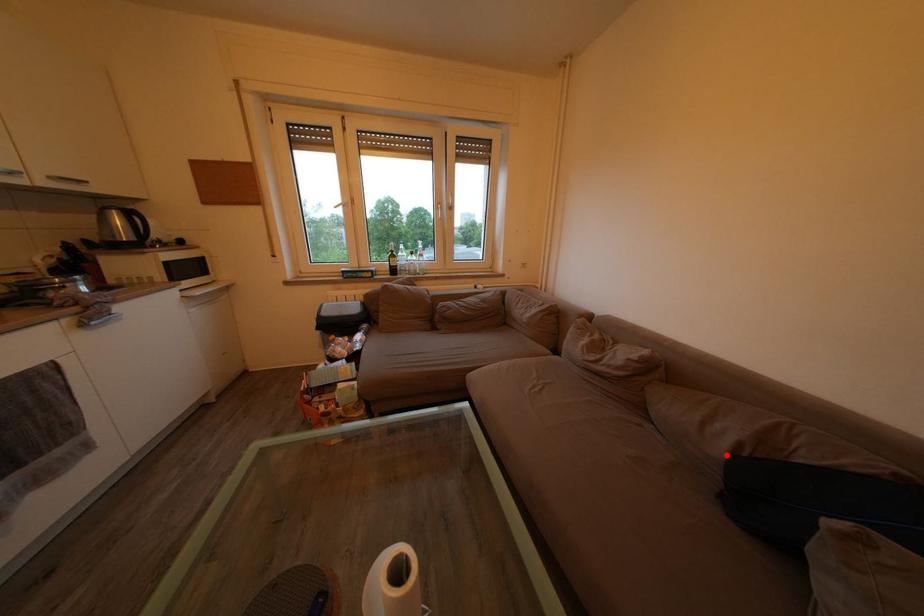
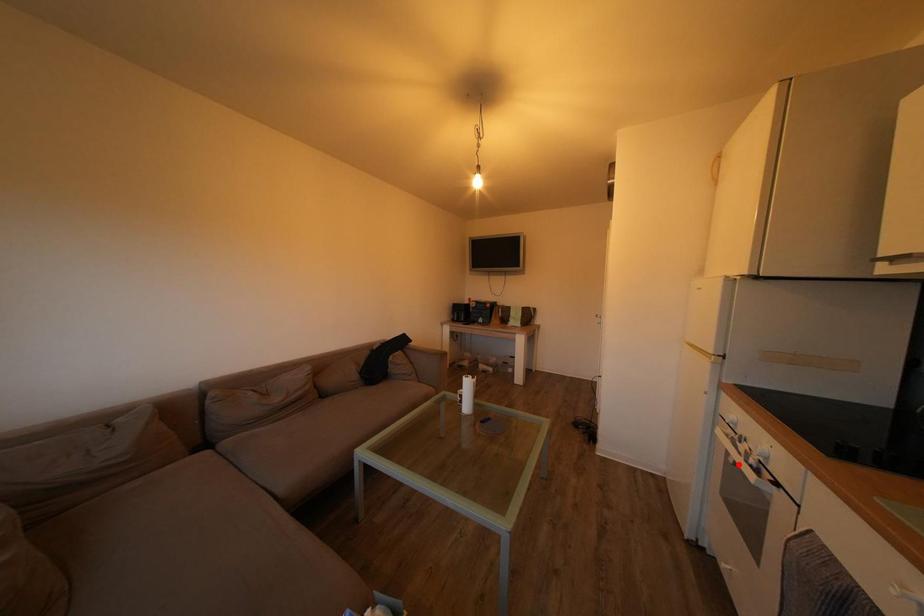
I am providing you with two images of the same scene from different viewpoints. A red point is marked on the first image and another point is marked on the second image. Does the point marked in image1 correspond to the same location as the one in image2?

No